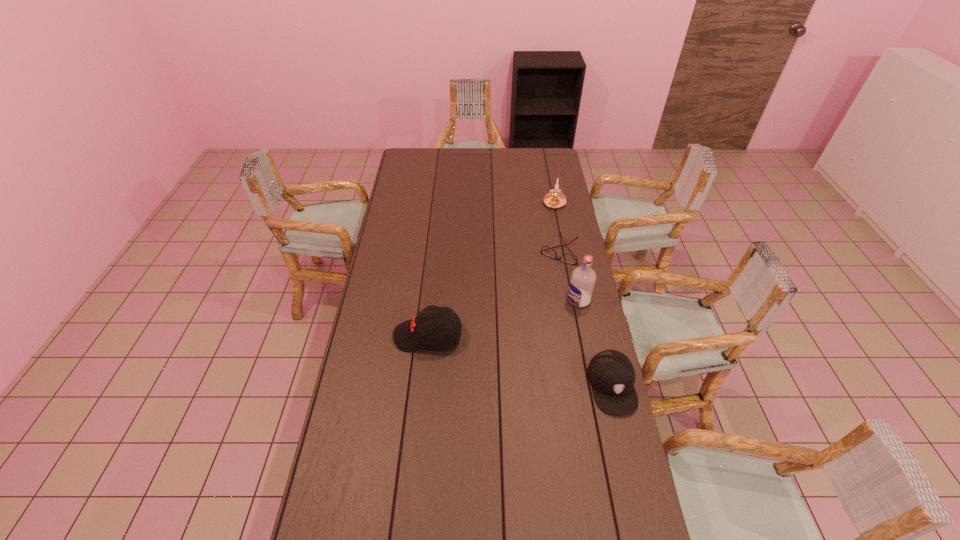
This screenshot has height=540, width=960. I want to click on the leftmost object, so click(x=438, y=328).

You are a GUI agent. You are given a task and a screenshot of the screen. Output one action in this format:
    pyautogui.click(x=<x>, y=<y>)
    Task: Click on the baseball cap
    
    Given the screenshot: What is the action you would take?
    pyautogui.click(x=438, y=328)

Image resolution: width=960 pixels, height=540 pixels. I want to click on the nearest object, so click(612, 376).

Image resolution: width=960 pixels, height=540 pixels. I want to click on the second shortest object, so click(x=612, y=376).

This screenshot has height=540, width=960. What are the coordinates of `the fourth nearest object` in the screenshot? It's located at (546, 250).

Locate an element on the screen. This screenshot has width=960, height=540. the shortest object is located at coordinates (546, 250).

This screenshot has height=540, width=960. Identify the location of the third farthest object. (581, 286).

The width and height of the screenshot is (960, 540). Identify the location of vodka. (581, 286).

Locate an element on the screen. the farthest object is located at coordinates (554, 199).

This screenshot has width=960, height=540. I want to click on vacant region located 0.130m on the front-facing side of the leftmost object, so click(360, 336).